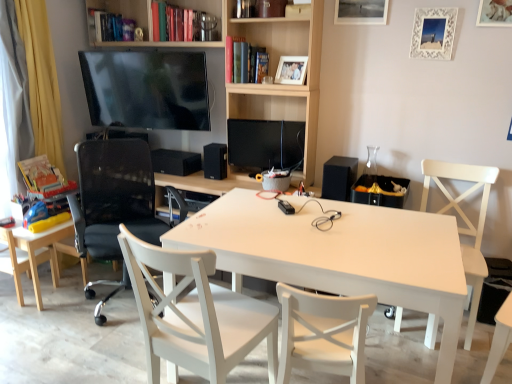
Locate an element on the screen. Image resolution: width=512 pixels, height=384 pixels. free space that is to the left of black mesh office chair at left, which is the 2th chair in left-to-right order is located at coordinates (44, 316).